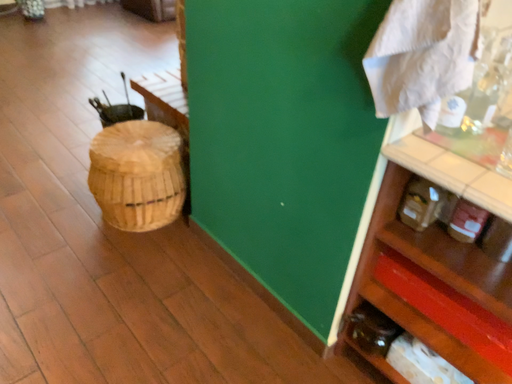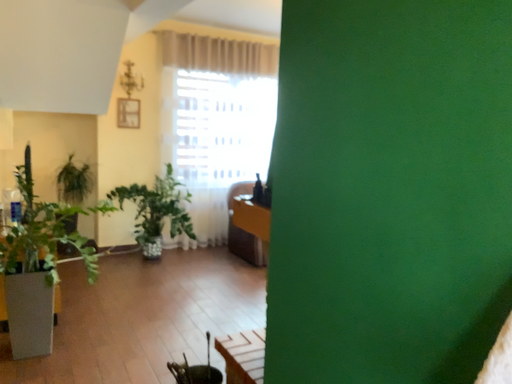
Question: How did the camera likely rotate when shooting the video?

Choices:
 (A) rotated upward
 (B) rotated downward

Answer: (A)